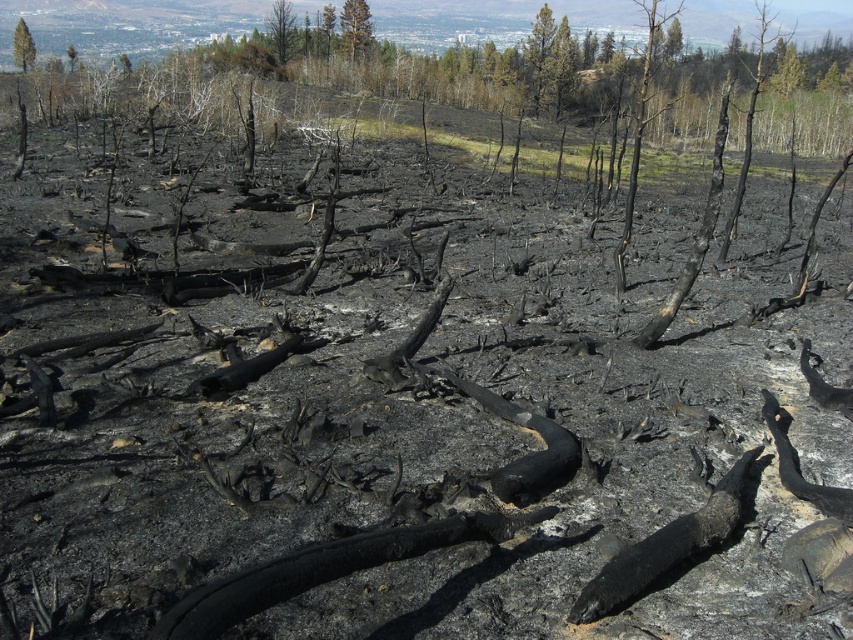
Is charcoal bark tree at upper center to the right of green matte tree at upper center from the viewer's perspective?

Indeed, charcoal bark tree at upper center is positioned on the right side of green matte tree at upper center.

Does point (648, 65) lie in front of point (282, 44)?

No.

What do you see at coordinates (639, 125) in the screenshot? I see `charcoal bark tree at upper center` at bounding box center [639, 125].

Image resolution: width=853 pixels, height=640 pixels. Find the location of `charcoal bark tree at upper center`. charcoal bark tree at upper center is located at coordinates (639, 125).

Based on the photo, between green leafy tree at upper left and charred wood tree at upper left, which one appears on the right side from the viewer's perspective?

From the viewer's perspective, charred wood tree at upper left appears more on the right side.

Does green leafy tree at upper left come in front of charred wood tree at upper left?

Yes, it is in front of charred wood tree at upper left.

In the scene shown: Who is more forward, (22,61) or (73,58)?

Positioned in front is point (22,61).

Locate an element on the screen. This screenshot has height=640, width=853. green leafy tree at upper left is located at coordinates (22, 45).

Who is positioned more to the left, green matte tree at upper center or green leafy tree at upper left?

From the viewer's perspective, green leafy tree at upper left appears more on the left side.

Can you confirm if green matte tree at upper center is taller than green leafy tree at upper left?

Incorrect, green matte tree at upper center's height is not larger of green leafy tree at upper left's.

Where is `green matte tree at upper center`? green matte tree at upper center is located at coordinates (281, 29).